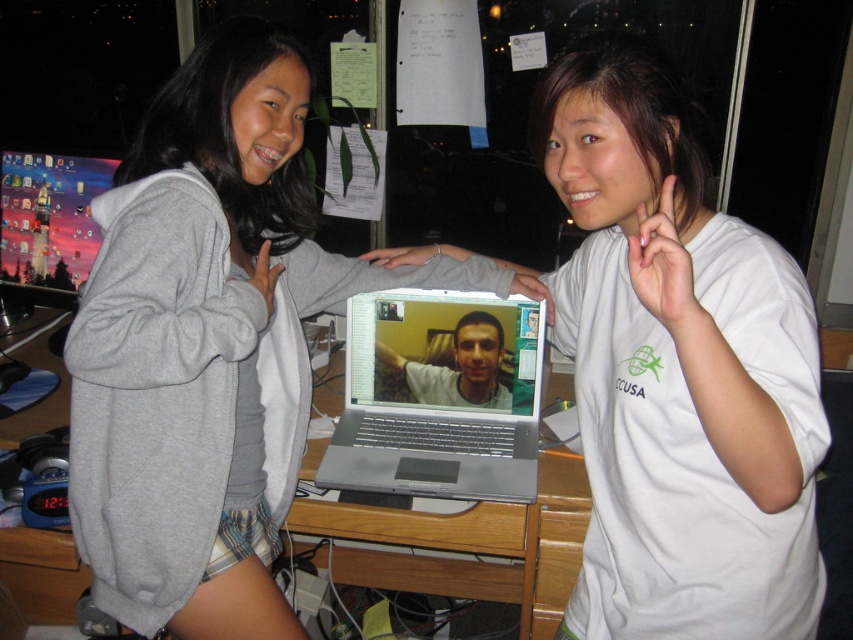
Question: Does gray hoodie at center appear over white cotton shirt at center?

Choices:
 (A) yes
 (B) no

Answer: (A)

Question: Which object is the farthest from the white cotton shirt at center?

Choices:
 (A) matte gray laptop at center
 (B) matte plastic monitor at left

Answer: (B)

Question: Which object is closer to the camera taking this photo?

Choices:
 (A) matte gray laptop at center
 (B) gray hoodie at center
 (C) silver metallic laptop at center
 (D) white cotton shirt at center

Answer: (D)

Question: Which object is positioned closest to the matte plastic monitor at left?

Choices:
 (A) gray hoodie at center
 (B) matte gray laptop at center

Answer: (A)

Question: In this image, where is gray hoodie at center located relative to matte gray laptop at center?

Choices:
 (A) below
 (B) above

Answer: (B)

Question: Does gray hoodie at center appear on the left side of wooden desk at center?

Choices:
 (A) yes
 (B) no

Answer: (A)